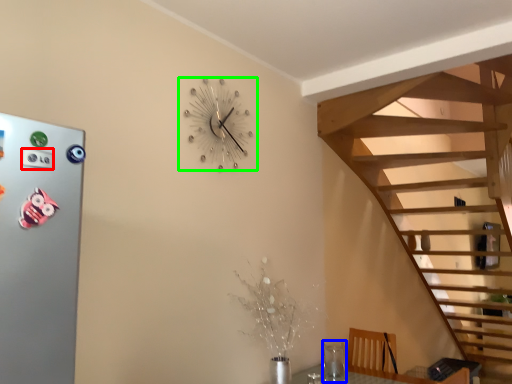
Question: Estimate the real-world distances between objects in this image. Which object is closer to button (highlighted by a red box), glass vase (highlighted by a blue box) or wall clock (highlighted by a green box)?

Choices:
 (A) glass vase
 (B) wall clock

Answer: (B)